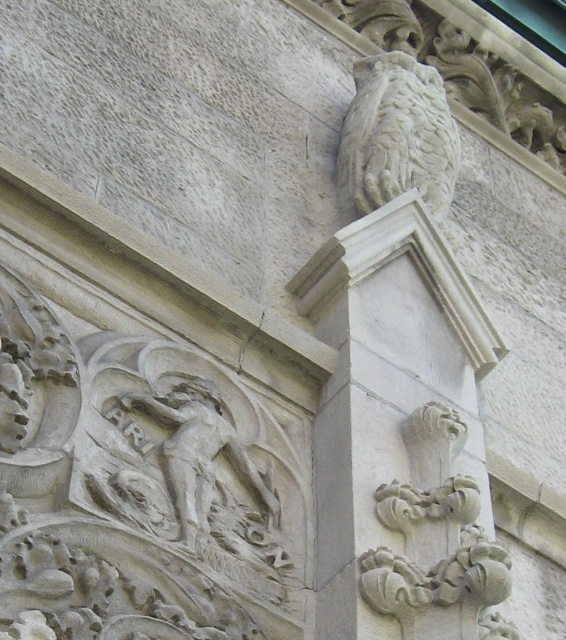
You are an architect examining the intricate carvings on a stone facade. You notice the white stone column at upper right and the white stone owl at upper right. Which of these two carvings is positioned to the left?

The white stone column at upper right is positioned to the left of the white stone owl at upper right.

You are an architect examining the stone carving. You notice a point marked at coordinates [396,136]. What object is located at this point?

The point at [396,136] indicates the location of the white stone owl at upper right.

You are an architect examining the intricate carvings on the stone facade. You notice the white stone column at upper right and the white stone owl at upper right. Which of these two carvings is wider?

The white stone column at upper right is wider than the white stone owl at upper right, as its width surpasses that of the owl.